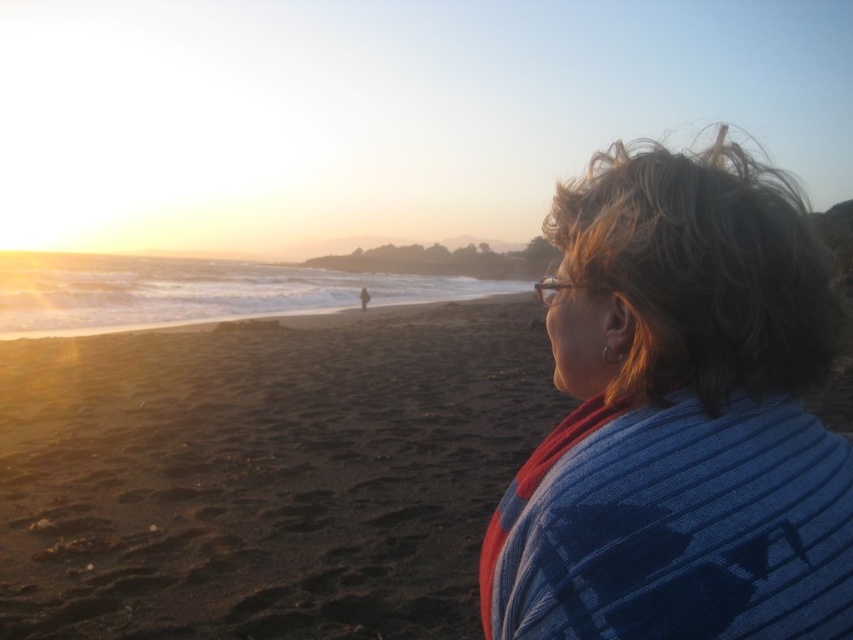
You are standing at the center of the beach scene. You want to walk towards the blue knitted sweater at upper right but need to avoid stepping on the dark sand at lower left. In which direction should you move first?

The dark sand at lower left is to the left of the blue knitted sweater at upper right. Therefore, you should move to the right first to avoid stepping on the dark sand at lower left and head toward the blue knitted sweater at upper right.

You are standing on the beach and want to walk from the dark sand at lower left to the blue knitted sweater at upper right. Which direction should you move in?

You should move towards the upper right direction to reach the blue knitted sweater at upper right from the dark sand at lower left.

You are standing on the beach and want to take a photo of the sunset. You have a camera that can only focus on objects within its frame. The blue knitted sweater at upper right and the dark sand at lower left are both in your viewfinder. Which object is closer to the camera based on their positions in the scene?

The dark sand at lower left is shorter than the blue knitted sweater at upper right, meaning the sweater is closer to the camera since shorter objects appear lower in the frame when closer.